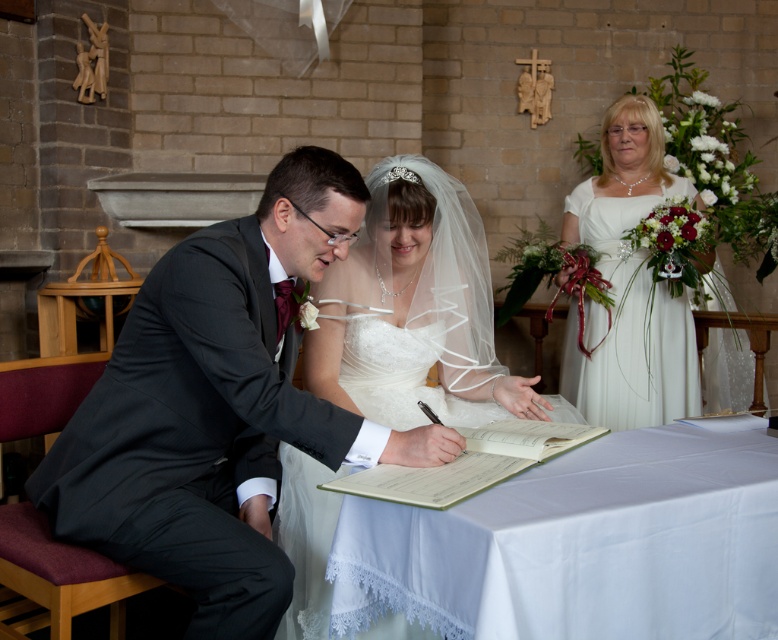
You are a photographer at a wedding and need to adjust the lighting so that both the dark gray suit at center and the white satin dress at center are equally visible. Which object requires more light adjustment? Explain why based on their positions and sizes.

The dark gray suit at center has a lesser height compared to the white satin dress at center, so it may require more light adjustment to ensure visibility since it is smaller and could be overshadowed by the taller dress.

You are a photographer positioned behind the white lace tablecloth at center and the white satin dress at right. You need to capture a closeup shot of the couple signing documents. Considering the distance between the tablecloth and the dress, will you need to adjust your camera focus to ensure both are in sharp focus?

The white lace tablecloth at center and white satin dress at right are 4.84 feet apart. To ensure both are in sharp focus, the photographer should adjust the camera focus to a point between them or use a smaller aperture for a greater depth of field.